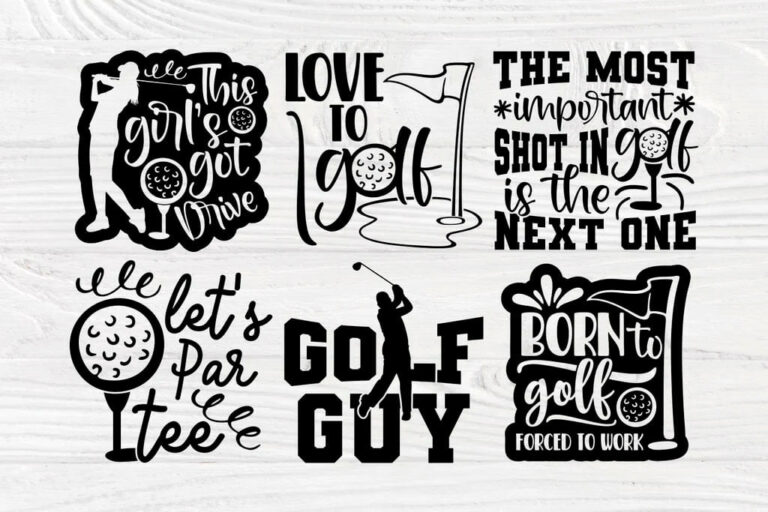
Find the location of a particular element. stickers is located at coordinates (203, 112), (415, 128), (550, 133), (558, 405), (406, 375), (204, 364).